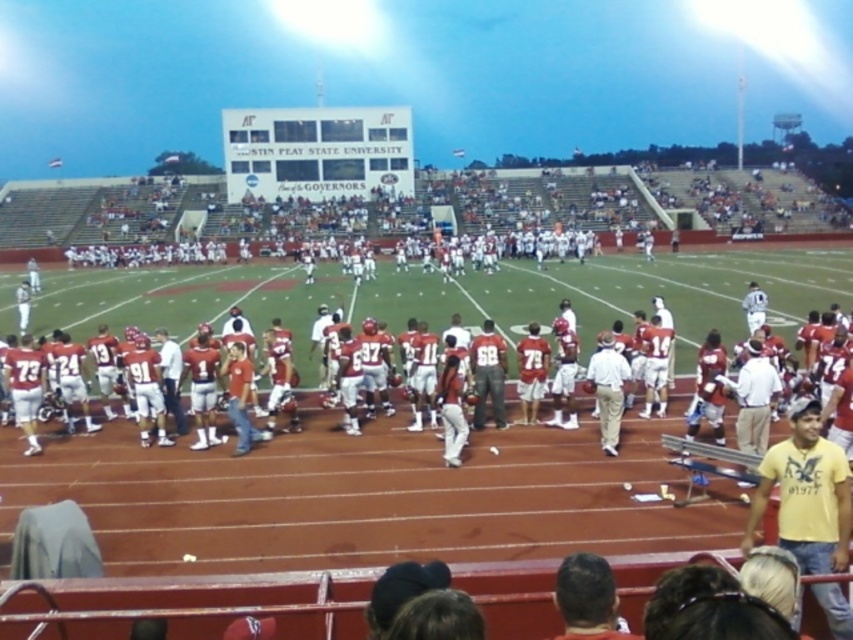
Question: Which point is closer to the camera?

Choices:
 (A) yellow cotton shirt at lower right
 (B) white cotton shirt at center

Answer: (A)

Question: Which of these objects is positioned closest to the white cotton shirt at center?

Choices:
 (A) yellow cotton shirt at lower right
 (B) matte gray pants at center

Answer: (B)

Question: Can you confirm if yellow cotton shirt at lower right is positioned to the left of matte gray pants at center?

Choices:
 (A) no
 (B) yes

Answer: (A)

Question: Is yellow cotton shirt at lower right further to the viewer compared to white cotton shirt at center?

Choices:
 (A) no
 (B) yes

Answer: (A)

Question: Is yellow cotton shirt at lower right below matte gray pants at center?

Choices:
 (A) no
 (B) yes

Answer: (B)

Question: Estimate the real-world distances between objects in this image. Which object is closer to the white cotton shirt at center?

Choices:
 (A) matte gray pants at center
 (B) yellow cotton shirt at lower right

Answer: (A)